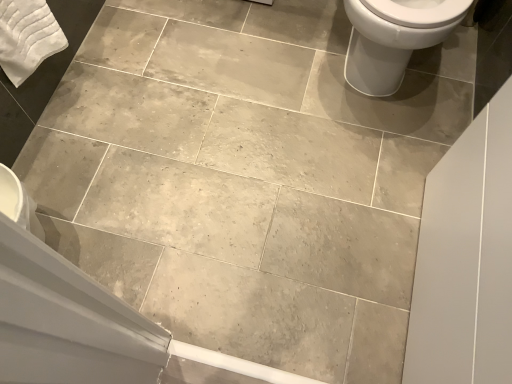
Question: From a real-world perspective, is white glossy toilet at upper right above or below white cotton bath towel at upper left?

Choices:
 (A) above
 (B) below

Answer: (B)

Question: From the image's perspective, is white glossy toilet at upper right located above or below white cotton bath towel at upper left?

Choices:
 (A) below
 (B) above

Answer: (B)

Question: In the image, is white glossy toilet at upper right on the left side or the right side of white cotton bath towel at upper left?

Choices:
 (A) right
 (B) left

Answer: (A)

Question: Which is correct: white cotton bath towel at upper left is inside white glossy toilet at upper right, or outside of it?

Choices:
 (A) outside
 (B) inside

Answer: (A)

Question: From the image's perspective, relative to white glossy toilet at upper right, is white cotton bath towel at upper left above or below?

Choices:
 (A) below
 (B) above

Answer: (A)

Question: Is white cotton bath towel at upper left bigger or smaller than white glossy toilet at upper right?

Choices:
 (A) big
 (B) small

Answer: (B)

Question: In terms of height, does white cotton bath towel at upper left look taller or shorter compared to white glossy toilet at upper right?

Choices:
 (A) short
 (B) tall

Answer: (A)